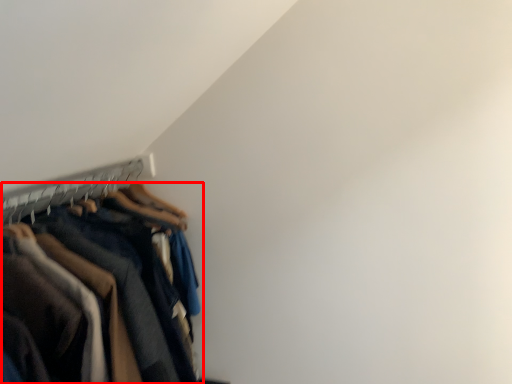
Question: From the image's perspective, what is the correct spatial positioning of trousers (annotated by the red box) in reference to hanger?

Choices:
 (A) below
 (B) above

Answer: (A)